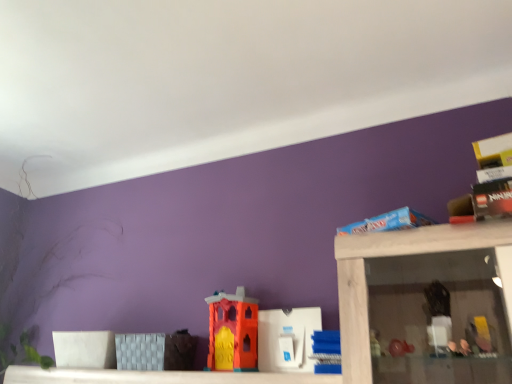
Question: Which direction should I rotate to face orange matte plastic castle at center, placed as the first toy when sorted from left to right, — up or down?

Choices:
 (A) down
 (B) up

Answer: (A)

Question: Can you confirm if orange matte plastic castle at center, placed as the first toy when sorted from left to right, is wider than blue plastic blocks at center, which is the 3th toy from left to right?

Choices:
 (A) no
 (B) yes

Answer: (A)

Question: Is orange matte plastic castle at center, placed as the first toy when sorted from left to right, facing towards blue plastic blocks at center, the first toy viewed from the right?

Choices:
 (A) yes
 (B) no

Answer: (B)

Question: Is orange matte plastic castle at center, placed as the first toy when sorted from left to right, bigger than blue plastic blocks at center, which is the 3th toy from left to right?

Choices:
 (A) no
 (B) yes

Answer: (B)

Question: Considering the relative sizes of orange matte plastic castle at center, placed as the first toy when sorted from left to right, and blue plastic blocks at center, which is the 3th toy from left to right, in the image provided, is orange matte plastic castle at center, placed as the first toy when sorted from left to right, shorter than blue plastic blocks at center, which is the 3th toy from left to right,?

Choices:
 (A) no
 (B) yes

Answer: (A)

Question: From the image's perspective, would you say orange matte plastic castle at center, placed as the first toy when sorted from left to right, is shown under blue plastic blocks at center, which is the 3th toy from left to right?

Choices:
 (A) yes
 (B) no

Answer: (A)

Question: Does orange matte plastic castle at center, placed as the first toy when sorted from left to right, have a lesser width compared to blue plastic blocks at center, the first toy viewed from the right?

Choices:
 (A) no
 (B) yes

Answer: (B)

Question: Does white plastic toy at center, which is the second toy in right-to-left order, have a greater height compared to orange matte plastic castle at center, placed as the first toy when sorted from left to right?

Choices:
 (A) yes
 (B) no

Answer: (B)

Question: Does white plastic toy at center, which is the second toy in left-to-right order, turn towards orange matte plastic castle at center, placed as the first toy when sorted from left to right?

Choices:
 (A) yes
 (B) no

Answer: (B)

Question: Is white plastic toy at center, which is the second toy in right-to-left order, further to camera compared to orange matte plastic castle at center, placed as the first toy when sorted from left to right?

Choices:
 (A) no
 (B) yes

Answer: (A)

Question: Considering the relative sizes of white plastic toy at center, which is the second toy in right-to-left order, and orange matte plastic castle at center, marked as the 3th toy in a right-to-left arrangement, in the image provided, is white plastic toy at center, which is the second toy in right-to-left order, shorter than orange matte plastic castle at center, marked as the 3th toy in a right-to-left arrangement,?

Choices:
 (A) yes
 (B) no

Answer: (A)

Question: From a real-world perspective, is white plastic toy at center, which is the second toy in right-to-left order, under orange matte plastic castle at center, placed as the first toy when sorted from left to right?

Choices:
 (A) yes
 (B) no

Answer: (A)

Question: Is white plastic toy at center, which is the second toy in right-to-left order, positioned beyond the bounds of orange matte plastic castle at center, placed as the first toy when sorted from left to right?

Choices:
 (A) no
 (B) yes

Answer: (B)

Question: From the image's perspective, is orange matte plastic castle at center, marked as the 3th toy in a right-to-left arrangement, below white plastic toy at center, which is the second toy in right-to-left order?

Choices:
 (A) no
 (B) yes

Answer: (A)